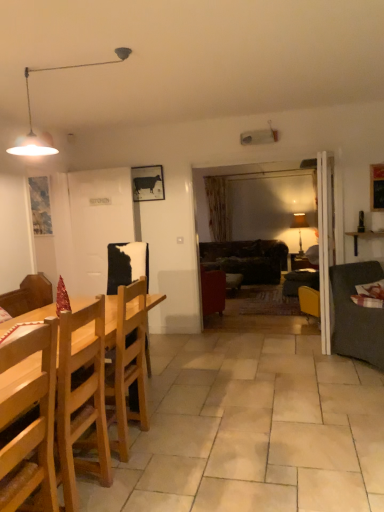
Question: Is metallic pendant light at upper left, which is counted as the 1th lamp, starting from the front, not near dark brown leather couch at center, which is counted as the 1th studio couch, starting from the back?

Choices:
 (A) no
 (B) yes

Answer: (B)

Question: From a real-world perspective, is metallic pendant light at upper left, which is counted as the 1th lamp, starting from the front, on top of dark brown leather couch at center, which is counted as the 1th studio couch, starting from the back?

Choices:
 (A) no
 (B) yes

Answer: (B)

Question: Can you confirm if metallic pendant light at upper left, placed as the 2th lamp when sorted from bottom to top, is shorter than dark brown leather couch at center, the 2th studio couch from the front?

Choices:
 (A) yes
 (B) no

Answer: (A)

Question: From the image's perspective, is metallic pendant light at upper left, the first lamp viewed from the left, on top of dark brown leather couch at center, which is counted as the 1th studio couch, starting from the back?

Choices:
 (A) no
 (B) yes

Answer: (B)

Question: Is metallic pendant light at upper left, the first lamp viewed from the left, not inside dark brown leather couch at center, the 2th studio couch from the front?

Choices:
 (A) no
 (B) yes

Answer: (B)

Question: Is light brown wooden chair at left, the first chair when ordered from back to front, situated inside dark gray fabric couch at right, the first studio couch from the front, or outside?

Choices:
 (A) outside
 (B) inside

Answer: (A)

Question: From the image's perspective, is light brown wooden chair at left, the first chair when ordered from back to front, positioned above or below dark gray fabric couch at right, which appears as the second studio couch when viewed from the back?

Choices:
 (A) above
 (B) below

Answer: (B)

Question: Is point (137, 330) positioned closer to the camera than point (347, 326)?

Choices:
 (A) farther
 (B) closer

Answer: (B)

Question: From a real-world perspective, is light brown wooden chair at left, the first chair when ordered from back to front, physically located above or below dark gray fabric couch at right, which appears as the second studio couch when viewed from the back?

Choices:
 (A) below
 (B) above

Answer: (B)

Question: From a real-world perspective, is light brown wooden chair at left, which ranks as the 2th chair in front-to-back order, above or below wooden shelf at right?

Choices:
 (A) above
 (B) below

Answer: (B)

Question: From the image's perspective, is light brown wooden chair at left, which ranks as the 2th chair in front-to-back order, above or below wooden shelf at right?

Choices:
 (A) below
 (B) above

Answer: (A)

Question: Considering the positions of point (119, 393) and point (359, 232), is point (119, 393) closer or farther from the camera than point (359, 232)?

Choices:
 (A) closer
 (B) farther

Answer: (A)

Question: Based on their sizes in the image, would you say light brown wooden chair at left, which ranks as the 2th chair in front-to-back order, is bigger or smaller than wooden shelf at right?

Choices:
 (A) big
 (B) small

Answer: (A)

Question: In terms of size, does light brown wooden chair at left, which ranks as the 2th chair in front-to-back order, appear bigger or smaller than dark brown leather couch at center, the 2th studio couch from the front?

Choices:
 (A) big
 (B) small

Answer: (B)

Question: In the image, is light brown wooden chair at left, which ranks as the 2th chair in front-to-back order, on the left side or the right side of dark brown leather couch at center, the 2th studio couch from the front?

Choices:
 (A) right
 (B) left

Answer: (B)